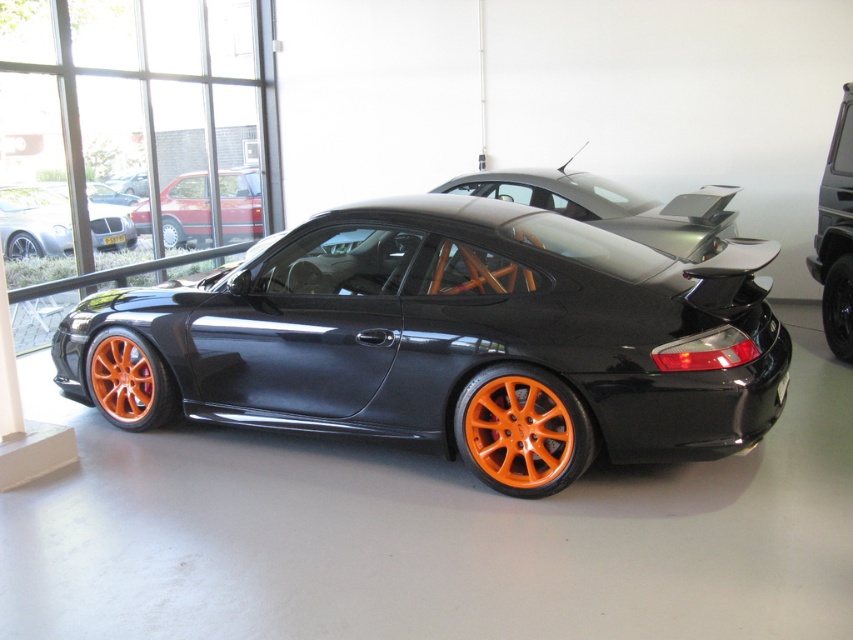
Does point (107, 240) lie in front of point (132, 192)?

Yes.

Does matte black car at left come in front of orange matte tire at center?

Yes.

Between point (39, 250) and point (132, 192), which one is positioned behind?

Positioned behind is point (132, 192).

You are a GUI agent. You are given a task and a screenshot of the screen. Output one action in this format:
    pyautogui.click(x=<x>, y=<y>)
    Task: Click on the matte black car at left
    The height and width of the screenshot is (640, 853).
    Given the screenshot: What is the action you would take?
    pyautogui.click(x=33, y=221)

Which of these two, orange matte wheel at lower center or matte orange wheels at center, stands taller?

Standing taller between the two is matte orange wheels at center.

Where is `orange matte wheel at lower center`? orange matte wheel at lower center is located at coordinates (521, 429).

Is point (521, 476) farther from viewer compared to point (224, 196)?

No, (521, 476) is in front of (224, 196).

The image size is (853, 640). I want to click on orange matte wheel at lower center, so click(521, 429).

Is black matte/satin car at right further to camera compared to matte orange wheels at center?

No, it is not.

Is point (836, 120) closer to camera compared to point (198, 209)?

Yes, point (836, 120) is closer to viewer.

What do you see at coordinates (836, 236) in the screenshot? I see `black matte/satin car at right` at bounding box center [836, 236].

Identify the location of black matte/satin car at right. (836, 236).